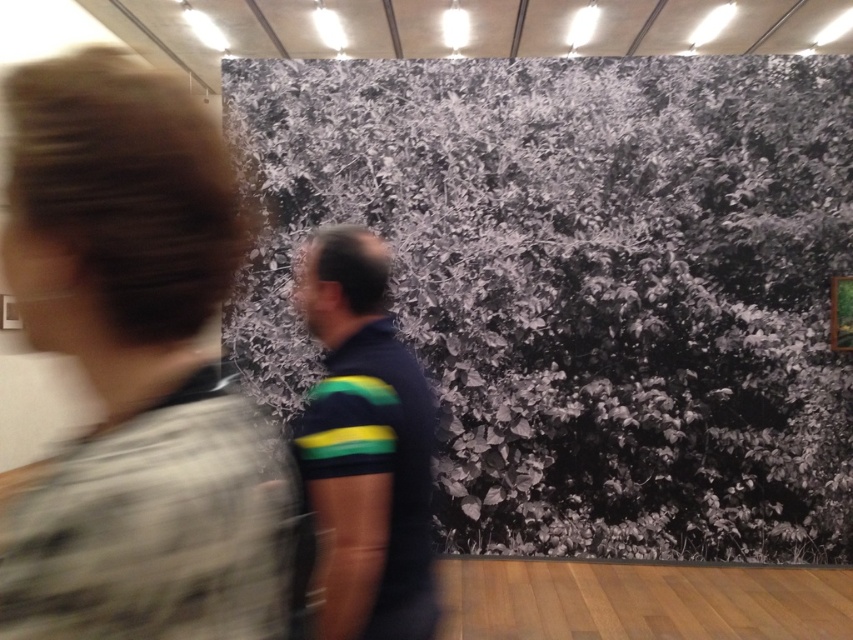
Based on the photo, you are standing in the art gallery and notice a point marked at coordinates (x=136, y=369). What is located at this point in the image?

The point at (x=136, y=369) marks blurred hair at the center of the image.

You are standing in the art gallery and want to touch the point at coordinates point (242,611) on the photograph. The gallery has a strict rule that visitors must maintain a minimum distance of 20 inches from all artworks. Can you safely reach the point without violating the rule?

The distance of point (242,611) from viewer is 20.39 inches, which is just over the required 20 inches minimum distance. Therefore, you can safely reach the point without breaking the gallery rules.